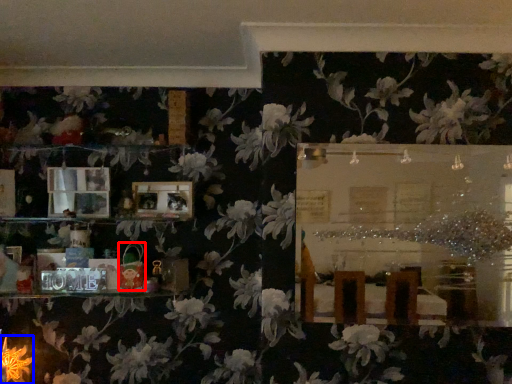
Question: Which point is closer to the camera, toy (highlighted by a red box) or flower (highlighted by a blue box)?

Choices:
 (A) toy
 (B) flower

Answer: (A)